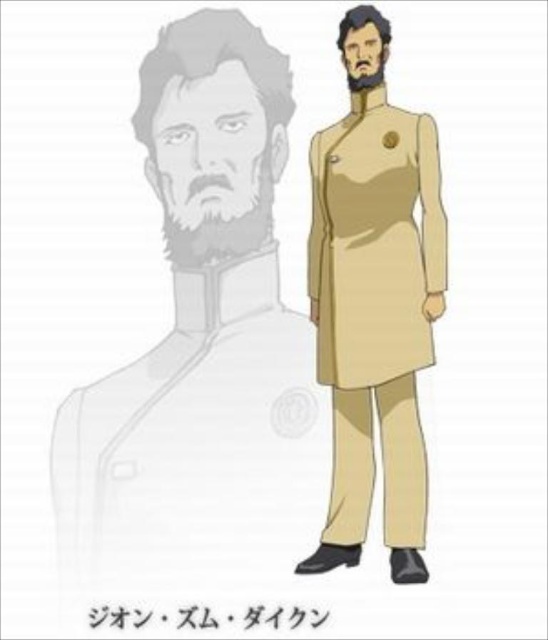
Who is positioned more to the left, beige fabric coat at center or beige matte trench coat at center?

From the viewer's perspective, beige fabric coat at center appears more on the left side.

Who is positioned more to the right, beige fabric coat at center or beige matte trench coat at center?

Positioned to the right is beige matte trench coat at center.

Describe the element at coordinates (202, 336) in the screenshot. Image resolution: width=548 pixels, height=640 pixels. I see `beige fabric coat at center` at that location.

What are the coordinates of `beige fabric coat at center` in the screenshot? It's located at (202, 336).